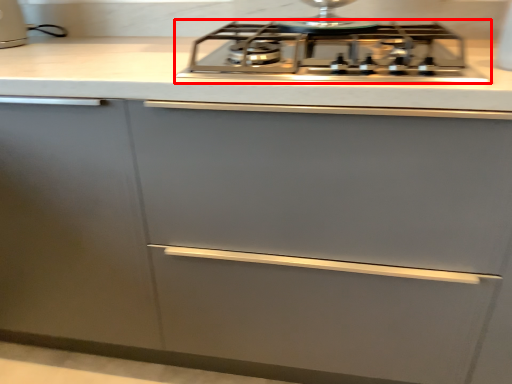
Question: Observing the image, what is the correct spatial positioning of gas stove (annotated by the red box) in reference to kitchen appliance?

Choices:
 (A) right
 (B) left

Answer: (A)